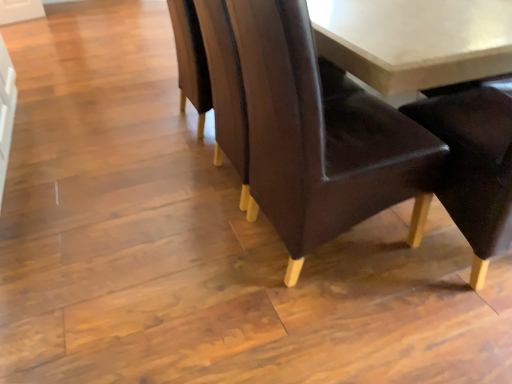
Measure the distance between matte brown leather chair at center and camera.

A distance of 32.80 inches exists between matte brown leather chair at center and camera.

What do you see at coordinates (322, 137) in the screenshot? I see `matte brown leather chair at center` at bounding box center [322, 137].

Find the location of `matte brown leather chair at center`. matte brown leather chair at center is located at coordinates (322, 137).

In order to face matte brown leather chair at center, should I rotate leftwards or rightwards?

To align with it, rotate right about 10.261°.

The image size is (512, 384). Describe the element at coordinates (414, 40) in the screenshot. I see `smooth brown table at upper right` at that location.

This screenshot has height=384, width=512. What are the coordinates of `smooth brown table at upper right` in the screenshot? It's located at (414, 40).

This screenshot has width=512, height=384. Find the location of `matte brown leather chair at center`. matte brown leather chair at center is located at coordinates pos(322,137).

Is smooth brown table at upper right to the left or to the right of matte brown leather chair at center in the image?

From the image, it's evident that smooth brown table at upper right is to the right of matte brown leather chair at center.

Is smooth brown table at upper right in front of or behind matte brown leather chair at center in the image?

smooth brown table at upper right is positioned farther from the viewer than matte brown leather chair at center.

Does point (366, 74) come closer to viewer compared to point (330, 116)?

Yes, point (366, 74) is in front of point (330, 116).

From the image's perspective, between smooth brown table at upper right and matte brown leather chair at center, which one is located above?

matte brown leather chair at center.

From a real-world perspective, is smooth brown table at upper right located higher than matte brown leather chair at center?

→ No, from a real-world perspective, smooth brown table at upper right is not over matte brown leather chair at center

Between smooth brown table at upper right and matte brown leather chair at center, which one has smaller width?

smooth brown table at upper right.

Considering the sizes of objects smooth brown table at upper right and matte brown leather chair at center in the image provided, who is taller, smooth brown table at upper right or matte brown leather chair at center?

Standing taller between the two is matte brown leather chair at center.

Based on their sizes in the image, would you say smooth brown table at upper right is bigger or smaller than matte brown leather chair at center?

Considering their sizes, smooth brown table at upper right takes up less space than matte brown leather chair at center.

Is smooth brown table at upper right positioned beyond the bounds of matte brown leather chair at center?

smooth brown table at upper right lies outside matte brown leather chair at center's area.

Is smooth brown table at upper right not near matte brown leather chair at center?

Actually, smooth brown table at upper right and matte brown leather chair at center are a little close together.

Is smooth brown table at upper right oriented away from matte brown leather chair at center?

smooth brown table at upper right is not turned away from matte brown leather chair at center.

From the picture: How far apart are smooth brown table at upper right and matte brown leather chair at center?

smooth brown table at upper right is 11.86 inches from matte brown leather chair at center.

The image size is (512, 384). I want to click on chair above the smooth brown table at upper right (from the image's perspective), so click(x=322, y=137).

Considering the relative positions of matte brown leather chair at center and smooth brown table at upper right in the image provided, is matte brown leather chair at center to the left of smooth brown table at upper right from the viewer's perspective?

Yes, matte brown leather chair at center is to the left of smooth brown table at upper right.

Which object is further away from the camera taking this photo, matte brown leather chair at center or smooth brown table at upper right?

smooth brown table at upper right is further from the camera.

Which is farther, (320, 239) or (357, 28)?

The point (320, 239) is more distant.

From the picture: From the image's perspective, which one is positioned higher, matte brown leather chair at center or smooth brown table at upper right?

matte brown leather chair at center, from the image's perspective.

From a real-world perspective, which is physically above, matte brown leather chair at center or smooth brown table at upper right?

matte brown leather chair at center is physically above.

Which of these two, matte brown leather chair at center or smooth brown table at upper right, is wider?

matte brown leather chair at center is wider.

Is matte brown leather chair at center shorter than smooth brown table at upper right?

No, matte brown leather chair at center is not shorter than smooth brown table at upper right.

Does matte brown leather chair at center have a smaller size compared to smooth brown table at upper right?

No.

Can smooth brown table at upper right be found inside matte brown leather chair at center?

Actually, smooth brown table at upper right is outside matte brown leather chair at center.

Are matte brown leather chair at center and smooth brown table at upper right beside each other?

matte brown leather chair at center and smooth brown table at upper right are not in contact.

Could you tell me if matte brown leather chair at center is turned towards smooth brown table at upper right?

Yes, matte brown leather chair at center is oriented towards smooth brown table at upper right.

How many degrees apart are the facing directions of matte brown leather chair at center and smooth brown table at upper right?

There is a 89.5-degree angle between the facing directions of matte brown leather chair at center and smooth brown table at upper right.

This screenshot has width=512, height=384. Find the location of `chair above the smooth brown table at upper right (from a real-world perspective)`. chair above the smooth brown table at upper right (from a real-world perspective) is located at coordinates (322, 137).

At what (x,y) coordinates should I click in order to perform the action: click on table that appears below the matte brown leather chair at center (from a real-world perspective). Please return your answer as a coordinate pair (x, y). The height and width of the screenshot is (384, 512). Looking at the image, I should click on pos(414,40).

You are a GUI agent. You are given a task and a screenshot of the screen. Output one action in this format:
    pyautogui.click(x=<x>, y=<y>)
    Task: Click on the chair lying on the left of smooth brown table at upper right
    Image resolution: width=512 pixels, height=384 pixels.
    Given the screenshot: What is the action you would take?
    pyautogui.click(x=322, y=137)